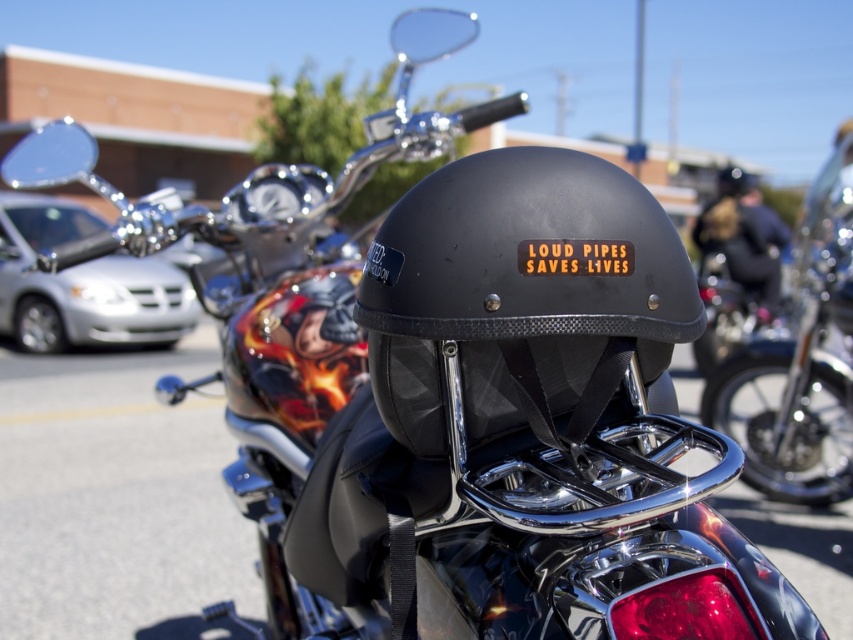
You are a photographer setting up a shot of the motorcycle and helmet. You want to ensure the matte black helmet at center and the shiny chrome motorcycle at center are both in focus. Since you can only focus on one object, which one should you focus on to ensure the other is also in focus given their positions?

The matte black helmet at center is positioned on the left side of shiny chrome motorcycle at center. Since they are both at the center of the image, focusing on either should keep both in focus as they are aligned centrally.

You are a photographer trying to capture the shiny chrome motorcycle at center and the matte black helmet at upper center in a single shot. Since the motorcycle is blocking the helmet, can you adjust your position to ensure both are fully visible without moving any objects?

The shiny chrome motorcycle at center is in front of the matte black helmet at upper center. Since the motorcycle is blocking the helmet, you cannot adjust your position to see both fully without moving the objects because the motorcycle is physically in front of the helmet, obscuring it.

You are a photographer trying to capture the motorcycle from a specific angle. You notice two points marked on the motorcycle in the image. The first point is at coordinates point (381, 342) and the second point is at point (795, 394). Which of these points appears closer to your camera lens based on their positions in the image?

Point (381, 342) is closer to the camera than point (795, 394).